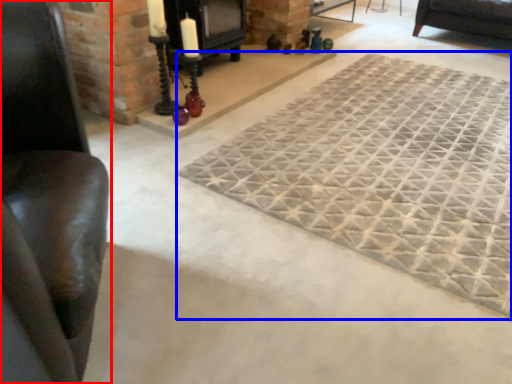
Question: Among these objects, which one is farthest to the camera, furniture (highlighted by a red box) or mat (highlighted by a blue box)?

Choices:
 (A) furniture
 (B) mat

Answer: (B)